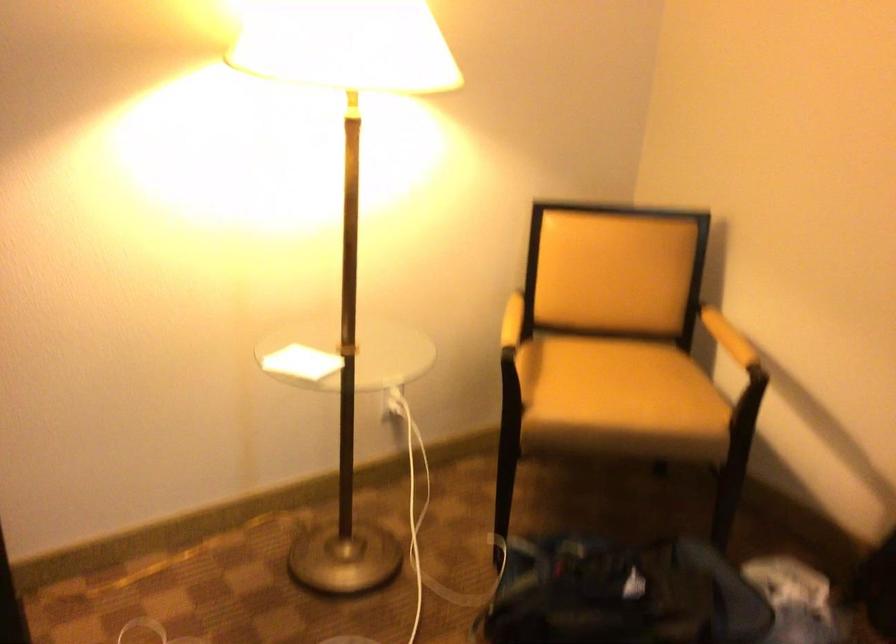
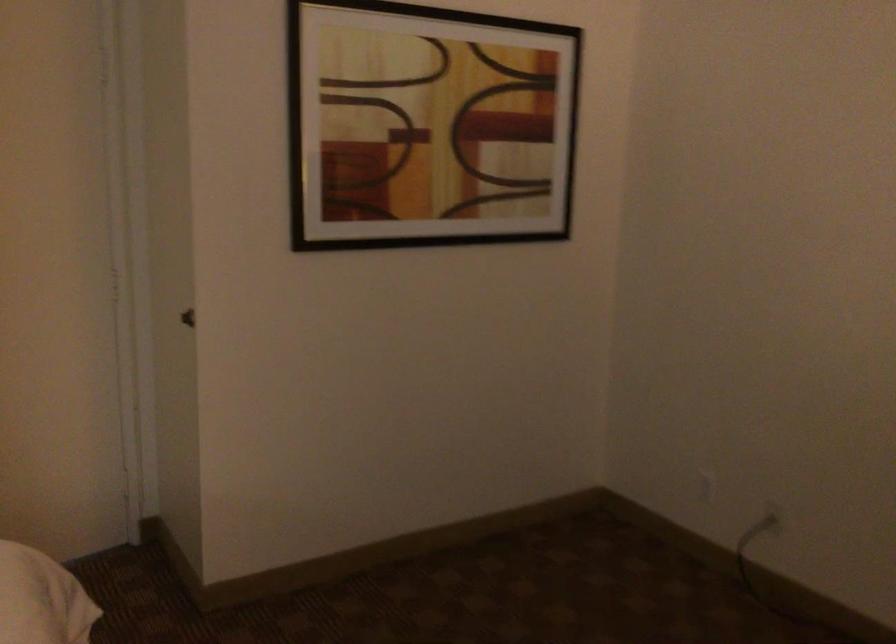
Question: The camera is either moving clockwise (left) or counter-clockwise (right) around the object. The first image is from the beginning of the video and the second image is from the end. Is the camera moving left or right when shooting the video?

Choices:
 (A) Left
 (B) Right

Answer: (B)